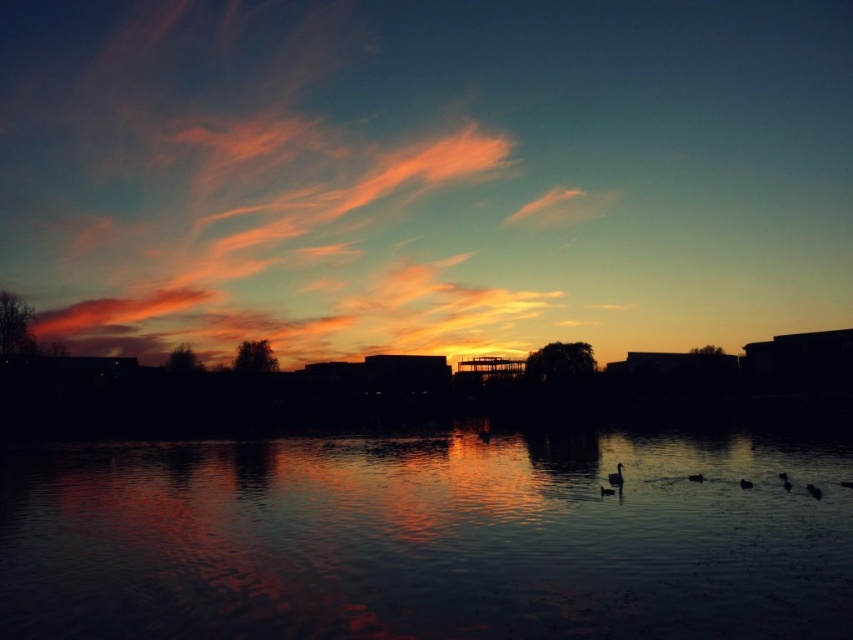
In the scene shown: Can you confirm if black matte duck at center is positioned above dark gray matte duck at lower right?

A: Yes, black matte duck at center is above dark gray matte duck at lower right.

Is point (619, 481) positioned after point (746, 481)?

No, (619, 481) is closer to viewer.

I want to click on black matte duck at center, so click(x=616, y=477).

Does point (358, 560) come behind point (622, 486)?

No, it is in front of (622, 486).

Is glossy reflective water at center below black matte duck at center?

Correct, glossy reflective water at center is located below black matte duck at center.

At what (x,y) coordinates should I click in order to perform the action: click on glossy reflective water at center. Please return your answer as a coordinate pair (x, y). The width and height of the screenshot is (853, 640). Looking at the image, I should click on [x=426, y=538].

Which is more to the left, black matte duck at lower right or dark gray matte duck at lower right?

From the viewer's perspective, black matte duck at lower right appears more on the left side.

Is point (691, 481) farther from camera compared to point (746, 483)?

Yes, it is.

In order to click on black matte duck at lower right in this screenshot , I will do `click(695, 477)`.